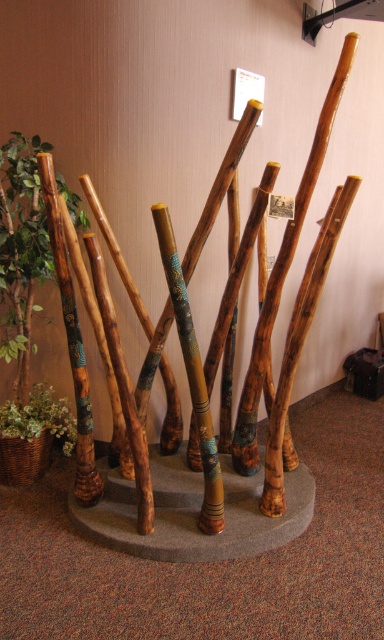
Question: Among these objects, which one is farthest from the camera?

Choices:
 (A) natural wood cane at center
 (B) green leafy plant at left
 (C) green leafy plant in woven basket at left

Answer: (C)

Question: Which point is closer to the camera taking this photo?

Choices:
 (A) (1, 195)
 (B) (81, 449)

Answer: (B)

Question: Can you confirm if wooden painted staff at center is bigger than green leafy plant in woven basket at left?

Choices:
 (A) yes
 (B) no

Answer: (A)

Question: Which of the following is the farthest from the observer?

Choices:
 (A) (8, 225)
 (B) (213, 464)
 (C) (44, 385)
 (D) (76, 404)

Answer: (C)

Question: Where is green leafy plant at left located in relation to green leafy plant in woven basket at left in the image?

Choices:
 (A) above
 (B) below

Answer: (A)

Question: Does wooden painted staff at center come in front of natural wood cane at center?

Choices:
 (A) no
 (B) yes

Answer: (B)